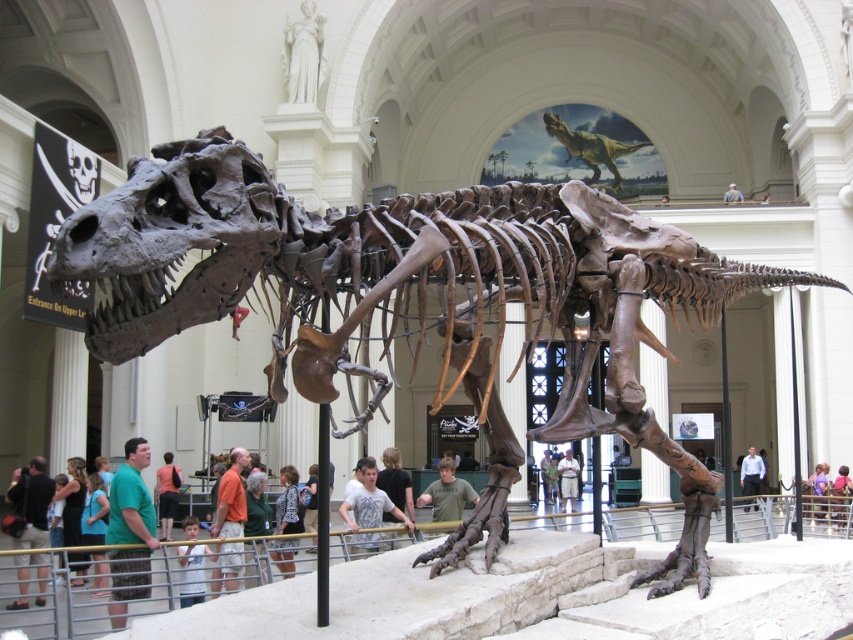
Question: Which object is the farthest from the brown fossilized skeleton at center?

Choices:
 (A) green fabric shirt at lower left
 (B) orange shirt at center

Answer: (B)

Question: Which of these objects is positioned closest to the green textured dinosaur at upper center?

Choices:
 (A) black textured shirt at center
 (B) green t-shirt at lower left
 (C) orange shirt at center
 (D) green fabric shirt at lower left

Answer: (C)

Question: Based on their relative distances, which object is farther from the light gray t-shirt at center?

Choices:
 (A) brown leather jacket at upper center
 (B) light brown fabric shirt at center
 (C) green textured dinosaur at upper center
 (D) black textured shirt at center

Answer: (C)

Question: Is orange shirt at center positioned in front of brown leather jacket at upper center?

Choices:
 (A) yes
 (B) no

Answer: (A)

Question: Is the position of brown fossilized skeleton at center more distant than that of light blue shirt at lower center?

Choices:
 (A) yes
 (B) no

Answer: (B)

Question: Is green t-shirt at lower left wider than light blue shirt at lower center?

Choices:
 (A) yes
 (B) no

Answer: (A)